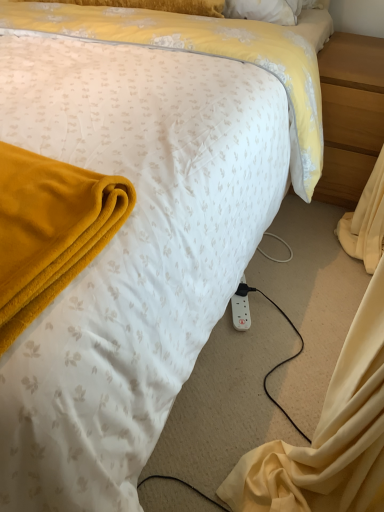
Question: Should I look upward or downward to see white plastic power outlet at lower right?

Choices:
 (A) down
 (B) up

Answer: (A)

Question: Can you confirm if white plastic power outlet at lower right is wider than light brown wood at right?

Choices:
 (A) yes
 (B) no

Answer: (B)

Question: Is white plastic power outlet at lower right far from light brown wood at right?

Choices:
 (A) yes
 (B) no

Answer: (B)

Question: Can you confirm if white plastic power outlet at lower right is bigger than light brown wood at right?

Choices:
 (A) no
 (B) yes

Answer: (A)

Question: Does white plastic power outlet at lower right have a smaller size compared to light brown wood at right?

Choices:
 (A) no
 (B) yes

Answer: (B)

Question: From a real-world perspective, is white plastic power outlet at lower right beneath light brown wood at right?

Choices:
 (A) no
 (B) yes

Answer: (B)

Question: Is white plastic power outlet at lower right taller than light brown wood at right?

Choices:
 (A) no
 (B) yes

Answer: (A)

Question: Considering the relative sizes of light brown wood at right and white plastic power outlet at lower right in the image provided, is light brown wood at right thinner than white plastic power outlet at lower right?

Choices:
 (A) no
 (B) yes

Answer: (A)

Question: Is light brown wood at right smaller than white plastic power outlet at lower right?

Choices:
 (A) yes
 (B) no

Answer: (B)

Question: Does light brown wood at right turn towards white plastic power outlet at lower right?

Choices:
 (A) yes
 (B) no

Answer: (A)

Question: Can you confirm if light brown wood at right is taller than white plastic power outlet at lower right?

Choices:
 (A) no
 (B) yes

Answer: (B)

Question: Is white plastic power outlet at lower right at the back of light brown wood at right?

Choices:
 (A) no
 (B) yes

Answer: (A)

Question: Is light brown wood at right at the left side of white plastic power outlet at lower right?

Choices:
 (A) yes
 (B) no

Answer: (B)

Question: Looking at their shapes, would you say light brown wood at right is wider or thinner than white plastic power outlet at lower right?

Choices:
 (A) thin
 (B) wide

Answer: (B)